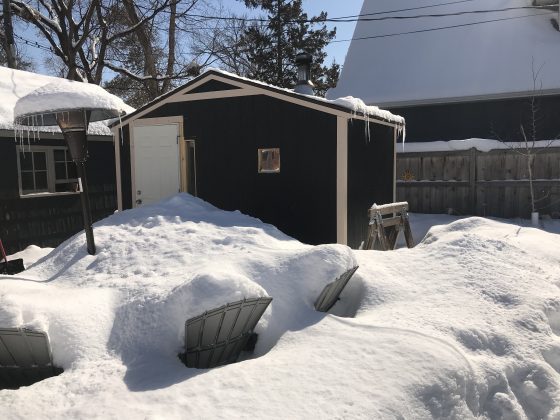
Where is `1 door`? 1 door is located at coordinates (150, 182).